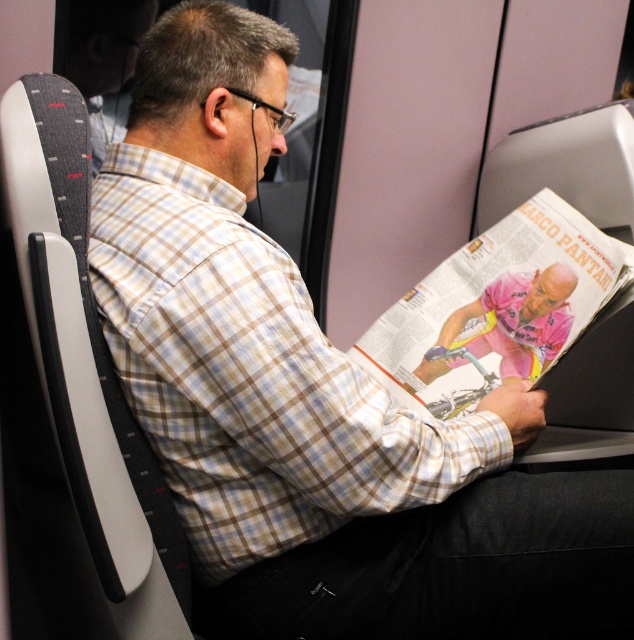
Between checkered fabric shirt at center and black denim pants at lower center, which one is positioned higher?

checkered fabric shirt at center is above.

Identify the location of checkered fabric shirt at center. point(250,376).

Which of these two, black denim pants at lower center or pink jersey cyclist at center, stands shorter?

pink jersey cyclist at center

Does black denim pants at lower center appear on the right side of pink jersey cyclist at center?

In fact, black denim pants at lower center is to the left of pink jersey cyclist at center.

Measure the distance between black denim pants at lower center and camera.

A distance of 35.68 inches exists between black denim pants at lower center and camera.

Find the location of `black denim pants at lower center`. black denim pants at lower center is located at coordinates (450, 568).

Does pink fabric magazine at center have a greater height compared to pink jersey cyclist at center?

Yes, pink fabric magazine at center is taller than pink jersey cyclist at center.

Is pink fabric magazine at center behind pink jersey cyclist at center?

No, it is in front of pink jersey cyclist at center.

Which is in front, point (469, 328) or point (555, 339)?

Point (555, 339) is in front.

This screenshot has height=640, width=634. Identify the location of pink fabric magazine at center. pos(496,308).